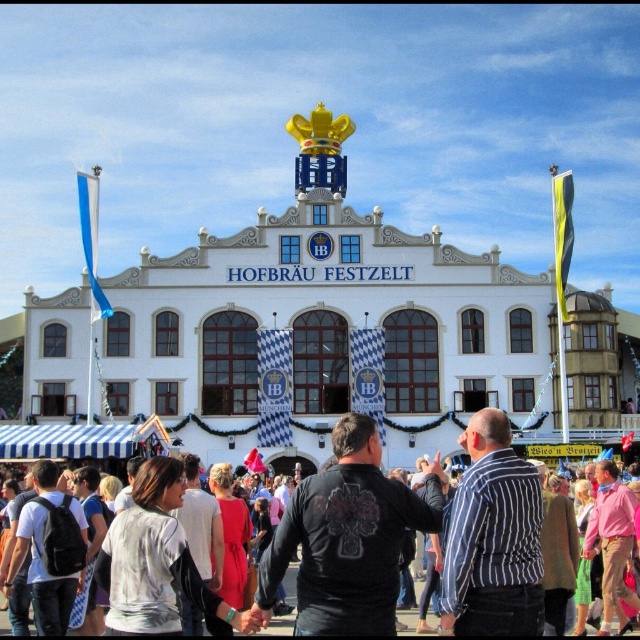
Is point (324, 552) more distant than point (563, 490)?

No.

How far apart are black leather jacket at center and white cotton shirt at center?

black leather jacket at center and white cotton shirt at center are 15.27 meters apart.

Who is more distant from viewer, (301, 557) or (0, 584)?

Point (0, 584)

This screenshot has height=640, width=640. What are the coordinates of `black leather jacket at center` in the screenshot? It's located at (348, 538).